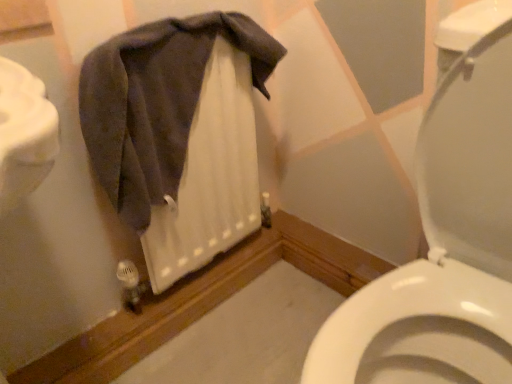
Measure the distance between point (109, 88) and camera.

The distance of point (109, 88) from camera is 30.43 inches.

Describe the element at coordinates (156, 102) in the screenshot. I see `dark gray cotton towel at upper left` at that location.

The image size is (512, 384). I want to click on dark gray cotton towel at upper left, so click(156, 102).

Describe the element at coordinates (445, 235) in the screenshot. I see `white glossy toilet at center` at that location.

Find the location of `white glossy toilet at center`. white glossy toilet at center is located at coordinates (445, 235).

What is the approximate height of white glossy toilet at center?

white glossy toilet at center is 33.10 inches in height.

Identify the location of dark gray cotton towel at upper left. The image size is (512, 384). (156, 102).

Considering the relative positions of white glossy toilet at center and dark gray cotton towel at upper left in the image provided, is white glossy toilet at center to the left of dark gray cotton towel at upper left from the viewer's perspective?

No, white glossy toilet at center is not to the left of dark gray cotton towel at upper left.

Is white glossy toilet at center further to the viewer compared to dark gray cotton towel at upper left?

No, white glossy toilet at center is closer to the camera.

Is point (474, 364) closer to camera compared to point (133, 195)?

Yes, it is in front of point (133, 195).

From the image's perspective, is white glossy toilet at center above or below dark gray cotton towel at upper left?

white glossy toilet at center is below dark gray cotton towel at upper left.

From a real-world perspective, who is located higher, white glossy toilet at center or dark gray cotton towel at upper left?

dark gray cotton towel at upper left is physically above.

Considering the sizes of objects white glossy toilet at center and dark gray cotton towel at upper left in the image provided, who is thinner, white glossy toilet at center or dark gray cotton towel at upper left?

Thinner between the two is dark gray cotton towel at upper left.

Can you confirm if white glossy toilet at center is shorter than dark gray cotton towel at upper left?

No, white glossy toilet at center is not shorter than dark gray cotton towel at upper left.

Which of these two, white glossy toilet at center or dark gray cotton towel at upper left, is bigger?

With larger size is white glossy toilet at center.

Is white glossy toilet at center surrounding dark gray cotton towel at upper left?

No, dark gray cotton towel at upper left is not inside white glossy toilet at center.

Is white glossy toilet at center far from dark gray cotton towel at upper left?

That's not correct — white glossy toilet at center is a little close to dark gray cotton towel at upper left.

Is dark gray cotton towel at upper left at the back of white glossy toilet at center?

white glossy toilet at center is not turned away from dark gray cotton towel at upper left.

What's the angular difference between white glossy toilet at center and dark gray cotton towel at upper left's facing directions?

white glossy toilet at center and dark gray cotton towel at upper left are facing 90 degrees away from each other.

You are a GUI agent. You are given a task and a screenshot of the screen. Output one action in this format:
    pyautogui.click(x=<x>, y=<y>)
    Task: Click on the bath towel that appears above the white glossy toilet at center (from a real-world perspective)
    This screenshot has width=512, height=384.
    Given the screenshot: What is the action you would take?
    pyautogui.click(x=156, y=102)

Which is more to the right, dark gray cotton towel at upper left or white glossy toilet at center?

white glossy toilet at center.

Considering their positions, is dark gray cotton towel at upper left located in front of or behind white glossy toilet at center?

Visually, dark gray cotton towel at upper left is located behind white glossy toilet at center.

Which is behind, point (247, 38) or point (477, 56)?

Positioned behind is point (247, 38).

From the image's perspective, which one is positioned higher, dark gray cotton towel at upper left or white glossy toilet at center?

dark gray cotton towel at upper left.

From a real-world perspective, is dark gray cotton towel at upper left physically below white glossy toilet at center?

Incorrect, from a real-world perspective, dark gray cotton towel at upper left is higher than white glossy toilet at center.

Consider the image. Considering the relative sizes of dark gray cotton towel at upper left and white glossy toilet at center in the image provided, is dark gray cotton towel at upper left wider than white glossy toilet at center?

No, dark gray cotton towel at upper left is not wider than white glossy toilet at center.

Considering the relative sizes of dark gray cotton towel at upper left and white glossy toilet at center in the image provided, is dark gray cotton towel at upper left taller than white glossy toilet at center?

No, dark gray cotton towel at upper left is not taller than white glossy toilet at center.

Can you confirm if dark gray cotton towel at upper left is bigger than white glossy toilet at center?

No.

Can white glossy toilet at center be found inside dark gray cotton towel at upper left?

That's incorrect, white glossy toilet at center is not inside dark gray cotton towel at upper left.

Is dark gray cotton towel at upper left touching white glossy toilet at center?

No.

Does dark gray cotton towel at upper left turn towards white glossy toilet at center?

Yes, dark gray cotton towel at upper left faces towards white glossy toilet at center.

How different are the orientations of dark gray cotton towel at upper left and white glossy toilet at center in degrees?

The angle between the facing direction of dark gray cotton towel at upper left and the facing direction of white glossy toilet at center is 90 degrees.

Image resolution: width=512 pixels, height=384 pixels. I want to click on bath towel that is above the white glossy toilet at center (from a real-world perspective), so click(x=156, y=102).

The image size is (512, 384). What are the coordinates of `toilet below the dark gray cotton towel at upper left (from a real-world perspective)` in the screenshot? It's located at (445, 235).

Find the location of a particular element. toilet located in front of the dark gray cotton towel at upper left is located at coordinates (445, 235).